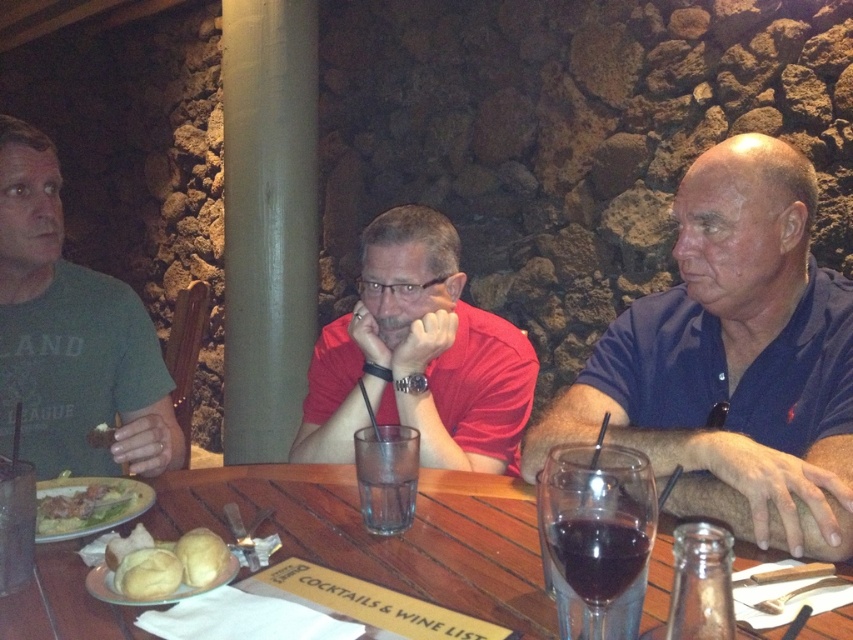
Between point (190, 474) and point (578, 564), which one is positioned in front?

Point (578, 564) is in front.

Between wooden table at center and dark glass wine at center, which one has less height?

Standing shorter between the two is wooden table at center.

Is point (456, 545) less distant than point (579, 529)?

No, it is not.

Where is `wooden table at center`? wooden table at center is located at coordinates (386, 538).

Is point (486, 339) positioned before point (582, 563)?

No, (486, 339) is behind (582, 563).

What do you see at coordinates (418, 356) in the screenshot? I see `matte red shirt at center` at bounding box center [418, 356].

Find the location of a particular element. The width and height of the screenshot is (853, 640). matte red shirt at center is located at coordinates (418, 356).

Which is more to the right, clear glass at table center or golden bread roll at center?

clear glass at table center is more to the right.

Which is in front, point (393, 516) or point (180, 552)?

Point (180, 552) is more forward.

The width and height of the screenshot is (853, 640). I want to click on clear glass at table center, so click(x=386, y=476).